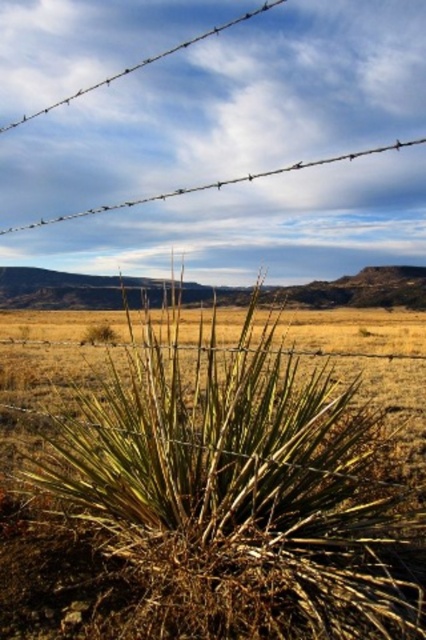
You are a hiker trying to navigate through the desert landscape. You see the brown dry grass at center. Can you estimate its location in the image using coordinates?

The brown dry grass at center is located at coordinates point (236, 486).

You are standing at the point marked by the coordinates point (236, 486) in the image. Looking around, you see a yucca plant with long, slender leaves and a barbed wire fence running horizontally across the middle. What do you see directly beneath your feet?

The point (236, 486) marks brown dry grass at center, so you are standing on brown dry grass at center.

You are a small desert lizard seeking shade. You notice the brown dry grass at center and the wire at upper center in the scene. Which of these two objects is taller and can provide better shade coverage?

The wire at upper center is taller than the brown dry grass at center, so it can provide better shade coverage.